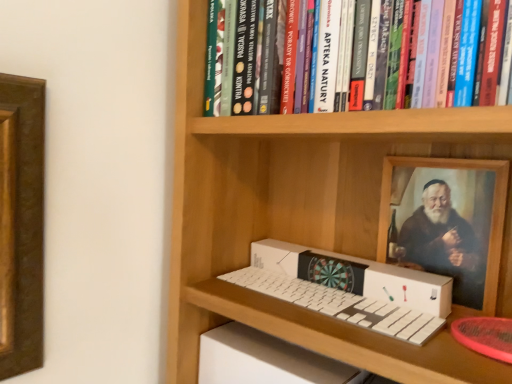
Question: Considering the positions of hardcover book at upper center and white cardboard box at center in the image, is hardcover book at upper center taller or shorter than white cardboard box at center?

Choices:
 (A) tall
 (B) short

Answer: (A)

Question: In the image, is hardcover book at upper center positioned in front of or behind white cardboard box at center?

Choices:
 (A) behind
 (B) front

Answer: (B)

Question: Looking at the image, does hardcover book at upper center seem bigger or smaller compared to white cardboard box at center?

Choices:
 (A) small
 (B) big

Answer: (B)

Question: Is white cardboard box at center bigger or smaller than hardcover book at upper center?

Choices:
 (A) small
 (B) big

Answer: (A)

Question: Is white cardboard box at center inside or outside of hardcover book at upper center?

Choices:
 (A) outside
 (B) inside

Answer: (A)

Question: Is white cardboard box at center to the left or to the right of hardcover book at upper center in the image?

Choices:
 (A) left
 (B) right

Answer: (B)

Question: Is white cardboard box at center taller or shorter than hardcover book at upper center?

Choices:
 (A) tall
 (B) short

Answer: (B)